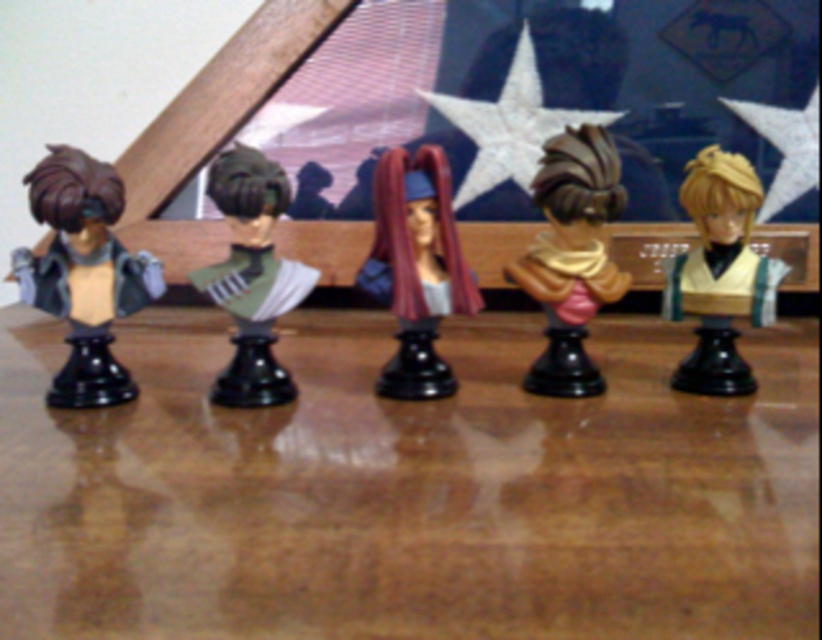
Question: Which point is farther to the camera?

Choices:
 (A) matte brown bust at center
 (B) matte black bust at left

Answer: (A)

Question: Is brown polished wood table at center thinner than matte green bust at center?

Choices:
 (A) yes
 (B) no

Answer: (B)

Question: Does matte black bust at left have a larger size compared to shiny gold bust at right?

Choices:
 (A) yes
 (B) no

Answer: (A)

Question: Does matte brown bust at center have a smaller size compared to matte green bust at center?

Choices:
 (A) no
 (B) yes

Answer: (A)

Question: Which point is closer to the camera?

Choices:
 (A) (381, 264)
 (B) (310, 460)

Answer: (B)

Question: Among these points, which one is nearest to the camera?

Choices:
 (A) (751, 168)
 (B) (384, 252)
 (C) (566, 211)
 (D) (84, 298)

Answer: (D)